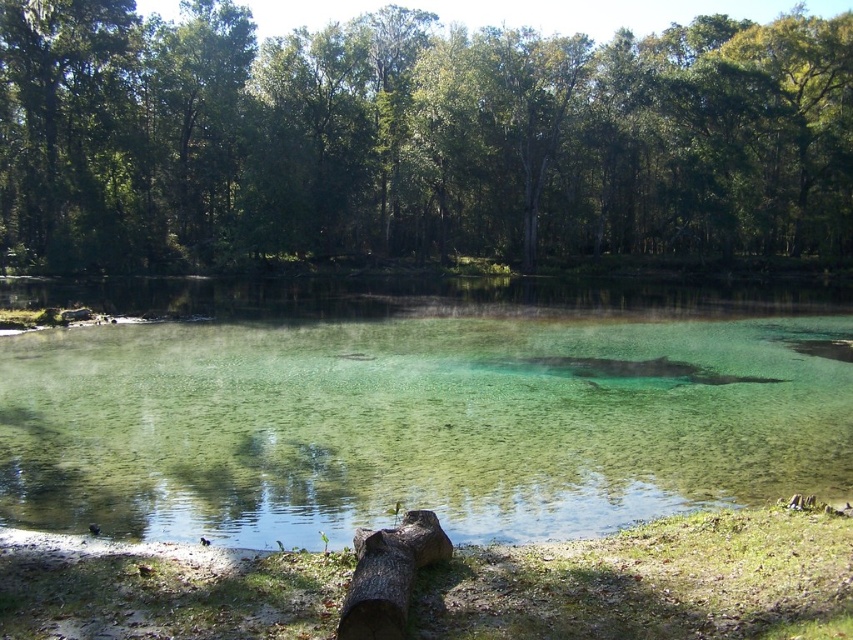
You are standing at the edge of the water and want to reach both the point at coordinates point (x=709, y=32) and point (x=376, y=602). Which point should you head towards first to minimize the distance walked?

You should head towards point (x=376, y=602) first because it is closer to you than point (x=709, y=32), which is further away.